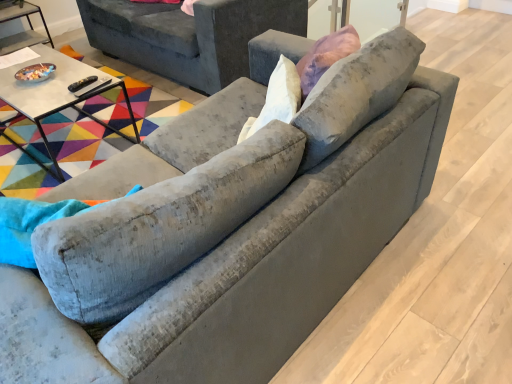
Find the location of a particular element. Image resolution: width=512 pixels, height=384 pixels. velvet gray swivel chair at left is located at coordinates (160, 227).

This screenshot has height=384, width=512. Describe the element at coordinates (21, 32) in the screenshot. I see `matte glass bowl at left, which is counted as the second table, starting from the right` at that location.

Image resolution: width=512 pixels, height=384 pixels. What do you see at coordinates (58, 92) in the screenshot? I see `white glossy table at upper left, the first table positioned from the right` at bounding box center [58, 92].

In order to face white glossy table at upper left, the first table positioned from the right, should I rotate leftwards or rightwards?

A 25.631 degree turn to the left will do.

The image size is (512, 384). What are the coordinates of `velvet gray swivel chair at left` in the screenshot? It's located at click(x=160, y=227).

Looking at this image, is matte glass bowl at left, the second table when ordered from front to back, shorter than velvet gray couch at upper center?

Indeed, matte glass bowl at left, the second table when ordered from front to back, has a lesser height compared to velvet gray couch at upper center.

Is matte glass bowl at left, the second table when ordered from front to back, thinner than velvet gray couch at upper center?

Yes.

Is matte glass bowl at left, which is the first table from back to front, positioned in front of velvet gray couch at upper center?

No, it is not.

Can you confirm if matte glass bowl at left, the second table when ordered from front to back, is positioned to the right of velvet gray couch at upper center?

Incorrect, matte glass bowl at left, the second table when ordered from front to back, is not on the right side of velvet gray couch at upper center.

From the picture: Is velvet gray swivel chair at left further to camera compared to velvet gray couch at upper center?

No, it is not.

How far apart are velvet gray swivel chair at left and velvet gray couch at upper center?

velvet gray swivel chair at left and velvet gray couch at upper center are 6.78 feet apart from each other.

From the image's perspective, which is above, velvet gray swivel chair at left or velvet gray couch at upper center?

velvet gray couch at upper center is shown above in the image.

Is velvet gray swivel chair at left not close to velvet gray couch at upper center?

Yes, velvet gray swivel chair at left is far from velvet gray couch at upper center.

Between white glossy table at upper left, the first table positioned from the right, and matte glass bowl at left, which is counted as the second table, starting from the right, which one has larger width?

white glossy table at upper left, the first table positioned from the right.

Is white glossy table at upper left, the 2th table when ordered from back to front, turned away from matte glass bowl at left, which is counted as the 1th table, starting from the left?

Correct, white glossy table at upper left, the 2th table when ordered from back to front, is looking away from matte glass bowl at left, which is counted as the 1th table, starting from the left.

Is matte glass bowl at left, which is the first table from back to front, a part of white glossy table at upper left, the first table positioned from the right?

No.

Where is `table that appears on the right of matte glass bowl at left, which is the first table from back to front`? The image size is (512, 384). table that appears on the right of matte glass bowl at left, which is the first table from back to front is located at coordinates (58, 92).

Which object is closer to the camera, velvet gray swivel chair at left or white glossy table at upper left, the 2th table when ordered from top to bottom?

velvet gray swivel chair at left.

Does point (280, 123) lie in front of point (45, 89)?

Yes.

Which table is the 1st one when counting from the back of the velvet gray swivel chair at left? Please provide its 2D coordinates.

[(58, 92)]

From the image's perspective, who appears lower, velvet gray swivel chair at left or white glossy table at upper left, which is counted as the first table, starting from the front?

velvet gray swivel chair at left is shown below in the image.

Can you confirm if velvet gray couch at upper center is bigger than white glossy table at upper left, which is counted as the first table, starting from the front?

Yes.

Visually, is velvet gray couch at upper center positioned to the left or to the right of white glossy table at upper left, marked as the 2th table in a left-to-right arrangement?

Based on their positions, velvet gray couch at upper center is located to the right of white glossy table at upper left, marked as the 2th table in a left-to-right arrangement.

Could you tell me if velvet gray couch at upper center is facing white glossy table at upper left, the 2th table when ordered from back to front?

Yes, velvet gray couch at upper center faces towards white glossy table at upper left, the 2th table when ordered from back to front.

Is velvet gray swivel chair at left outside of matte glass bowl at left, positioned as the 1th table in top-to-bottom order?

Yes.

From the image's perspective, which object appears higher, velvet gray swivel chair at left or matte glass bowl at left, the second table when ordered from front to back?

matte glass bowl at left, the second table when ordered from front to back, appears higher in the image.

Is velvet gray swivel chair at left behind matte glass bowl at left, which is counted as the second table, starting from the right?

That is False.

Is the surface of velvet gray couch at upper center in direct contact with velvet gray swivel chair at left?

No.

Is velvet gray couch at upper center inside the boundaries of velvet gray swivel chair at left, or outside?

velvet gray couch at upper center is outside velvet gray swivel chair at left.

From the image's perspective, which is below, velvet gray couch at upper center or velvet gray swivel chair at left?

velvet gray swivel chair at left.

Locate an element on the screen. The width and height of the screenshot is (512, 384). studio couch in front of the matte glass bowl at left, the second table when ordered from front to back is located at coordinates (189, 35).

At what (x,y) coordinates should I click in order to perform the action: click on swivel chair above the velvet gray couch at upper center (from a real-world perspective). Please return your answer as a coordinate pair (x, y). Looking at the image, I should click on (160, 227).

Estimate the real-world distances between objects in this image. Which object is further from velvet gray swivel chair at left, white glossy table at upper left, which is counted as the first table, starting from the front, or velvet gray couch at upper center?

The object further to velvet gray swivel chair at left is velvet gray couch at upper center.

When comparing their distances from white glossy table at upper left, the 2th table when ordered from back to front, does velvet gray swivel chair at left or velvet gray couch at upper center seem closer?

velvet gray couch at upper center is positioned closer to the anchor white glossy table at upper left, the 2th table when ordered from back to front.

From the picture: Which object lies nearer to the anchor point velvet gray couch at upper center, matte glass bowl at left, which is counted as the second table, starting from the right, or velvet gray swivel chair at left?

Among the two, matte glass bowl at left, which is counted as the second table, starting from the right, is located nearer to velvet gray couch at upper center.

Looking at the image, which one is located further to white glossy table at upper left, the first table positioned from the right, velvet gray couch at upper center or matte glass bowl at left, which is counted as the second table, starting from the right?

Among the two, matte glass bowl at left, which is counted as the second table, starting from the right, is located further to white glossy table at upper left, the first table positioned from the right.

From the image, which object appears to be nearer to velvet gray swivel chair at left, velvet gray couch at upper center or white glossy table at upper left, placed as the first table when sorted from bottom to top?

white glossy table at upper left, placed as the first table when sorted from bottom to top, is positioned closer to the anchor velvet gray swivel chair at left.

From the image, which object appears to be nearer to matte glass bowl at left, which is counted as the second table, starting from the right, velvet gray couch at upper center or velvet gray swivel chair at left?

Among the two, velvet gray couch at upper center is located nearer to matte glass bowl at left, which is counted as the second table, starting from the right.

When comparing their distances from velvet gray swivel chair at left, does velvet gray couch at upper center or matte glass bowl at left, which is counted as the second table, starting from the right, seem closer?

velvet gray couch at upper center.

Looking at the image, which one is located further to matte glass bowl at left, positioned as the 1th table in top-to-bottom order, white glossy table at upper left, the 2th table when ordered from top to bottom, or velvet gray swivel chair at left?

velvet gray swivel chair at left lies further to matte glass bowl at left, positioned as the 1th table in top-to-bottom order, than the other object.

The height and width of the screenshot is (384, 512). I want to click on table located between velvet gray swivel chair at left and velvet gray couch at upper center in the depth direction, so click(58, 92).

Locate an element on the screen. This screenshot has height=384, width=512. table between matte glass bowl at left, the second table when ordered from front to back, and velvet gray couch at upper center, in the horizontal direction is located at coordinates point(58,92).

Locate an element on the screen. The height and width of the screenshot is (384, 512). table between velvet gray swivel chair at left and matte glass bowl at left, the second table from the bottom, along the z-axis is located at coordinates click(58, 92).

I want to click on studio couch between velvet gray swivel chair at left and matte glass bowl at left, positioned as the 1th table in top-to-bottom order, in the front-back direction, so click(189, 35).